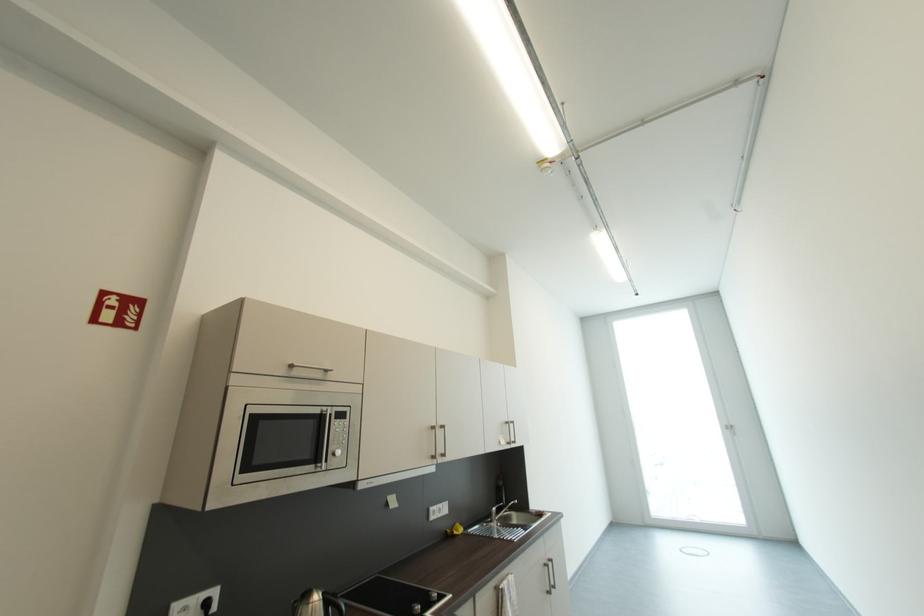
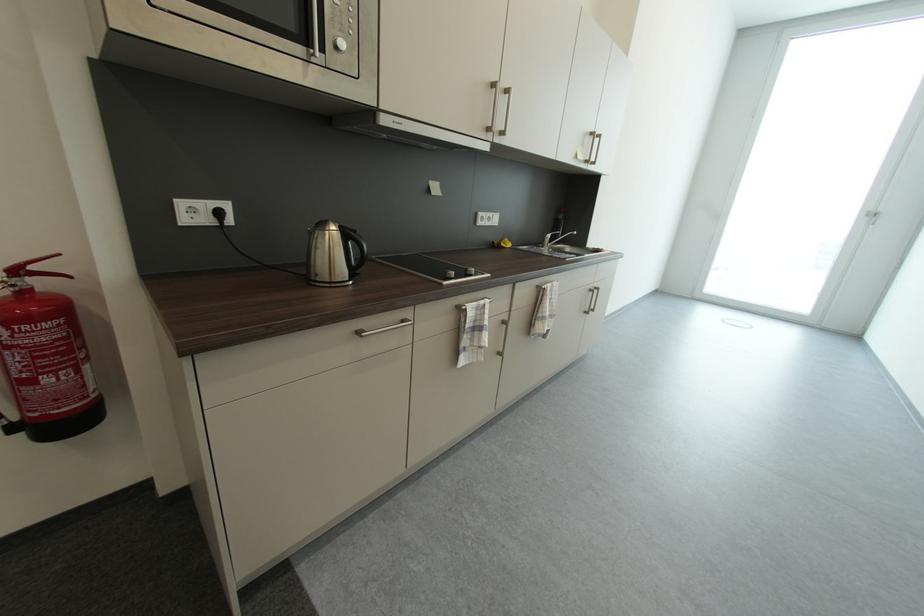
Question: Based on the continuous images, in which direction is the camera rotating? Reply with the corresponding letter.

Choices:
 (A) Left
 (B) Right
 (C) Up
 (D) Down

Answer: (D)